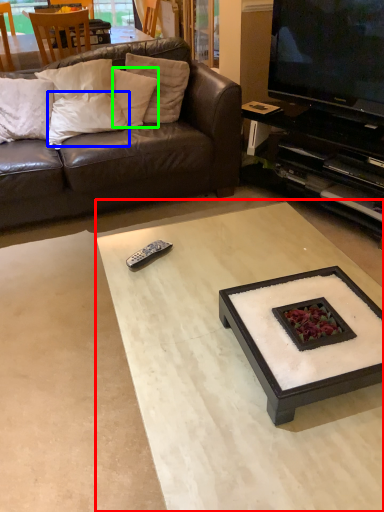
Question: Which object is positioned closest to coffee table (highlighted by a red box)? Select from pillow (highlighted by a blue box) and pillow (highlighted by a green box).

Choices:
 (A) pillow
 (B) pillow

Answer: (A)